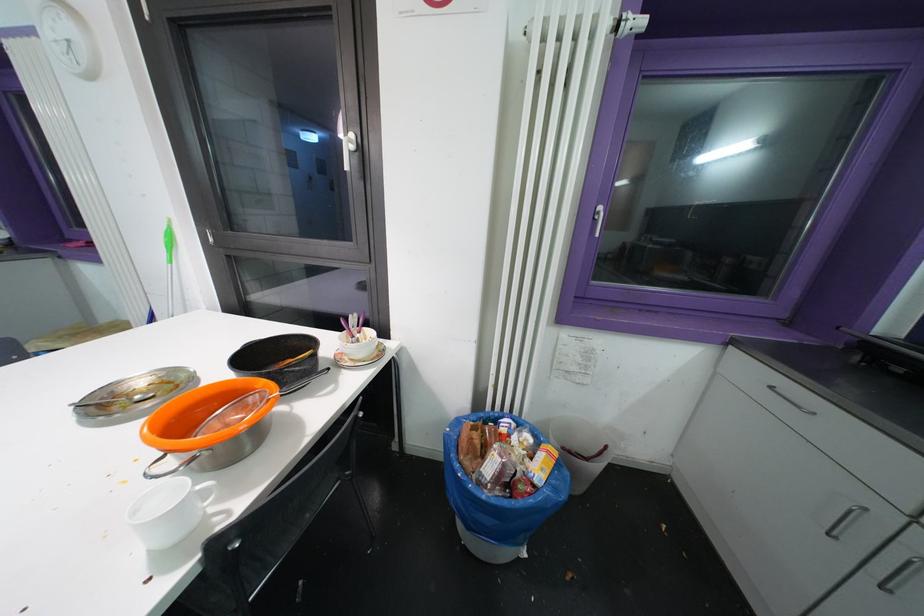
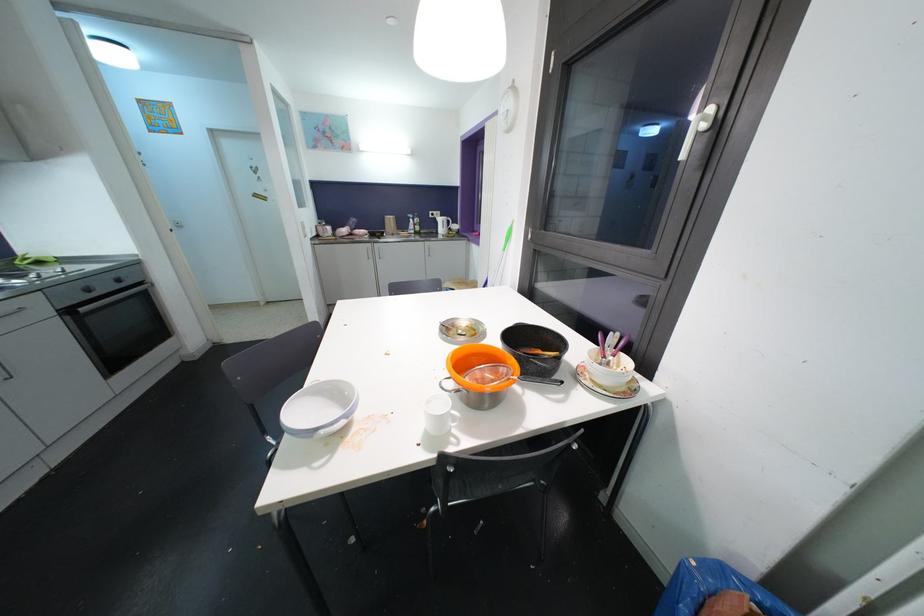
Locate, in the second image, the point that corresponds to pixel 105 408 in the first image.

(451, 331)